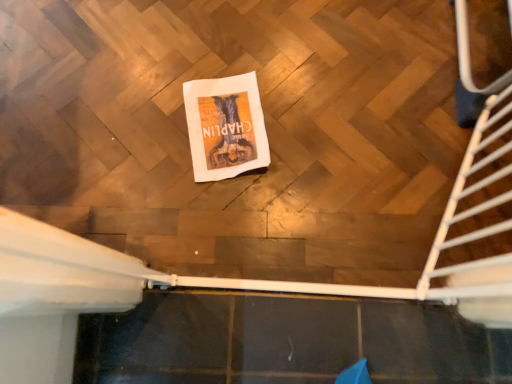
Identify the location of free space in front of white paper towel at center. (217, 212).